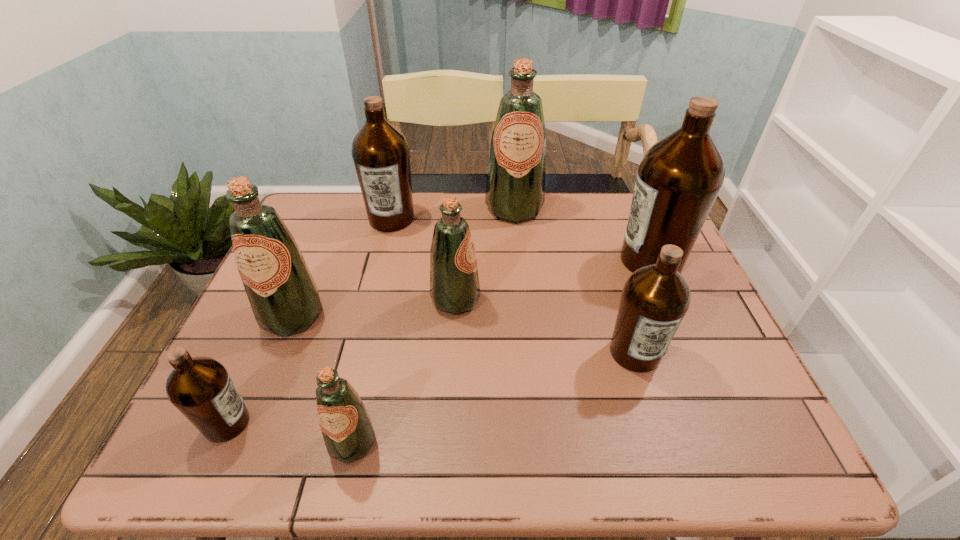
The width and height of the screenshot is (960, 540). I want to click on the smallest green olive oil, so click(348, 433).

You are a GUI agent. You are given a task and a screenshot of the screen. Output one action in this format:
    pyautogui.click(x=<x>, y=<y>)
    Task: Click on the nearest brown olive oil
    Image resolution: width=960 pixels, height=540 pixels.
    Given the screenshot: What is the action you would take?
    pyautogui.click(x=200, y=388)

This screenshot has width=960, height=540. I want to click on the leftmost brown olive oil, so click(200, 388).

Locate an element on the screen. The image size is (960, 540). blank area located on the front-facing side of the rightmost green olive oil is located at coordinates (523, 299).

Where is `vacant space situated 0.230m on the label of the second farthest brown olive oil`? This screenshot has width=960, height=540. vacant space situated 0.230m on the label of the second farthest brown olive oil is located at coordinates (535, 261).

Where is `vacant space located 0.120m on the label of the second farthest brown olive oil`? The height and width of the screenshot is (540, 960). vacant space located 0.120m on the label of the second farthest brown olive oil is located at coordinates (574, 261).

Identify the location of free space located on the label of the second farthest brown olive oil. (538, 261).

Locate an element on the screen. Image resolution: width=960 pixels, height=540 pixels. vacant point located 0.200m on the label of the third brown olive oil from right to left is located at coordinates (376, 280).

Locate an element on the screen. This screenshot has width=960, height=540. vacant space located on the front-facing side of the second biggest green olive oil is located at coordinates (248, 424).

What are the coordinates of `free region located on the front-facing side of the fourth olive oil from right to left` in the screenshot? It's located at (583, 300).